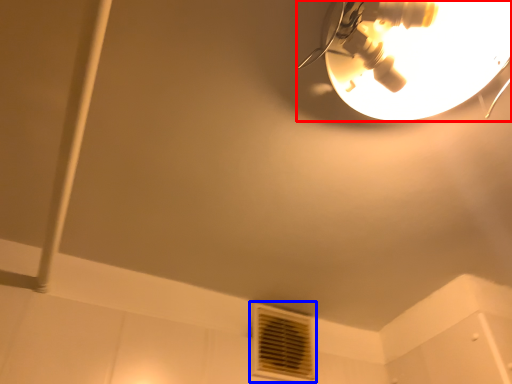
Question: Which object is closer to the camera taking this photo, lamp (highlighted by a red box) or air conditioning (highlighted by a blue box)?

Choices:
 (A) lamp
 (B) air conditioning

Answer: (A)